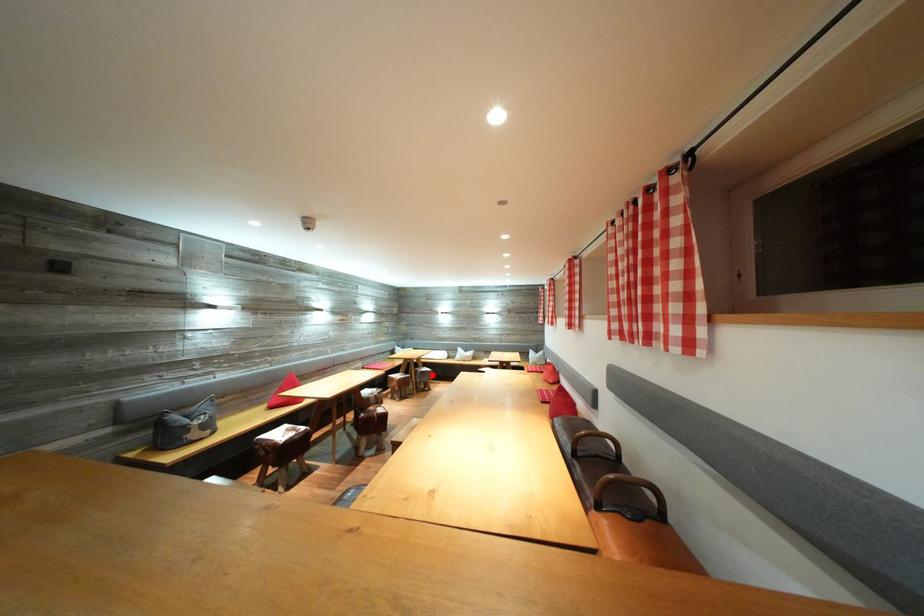
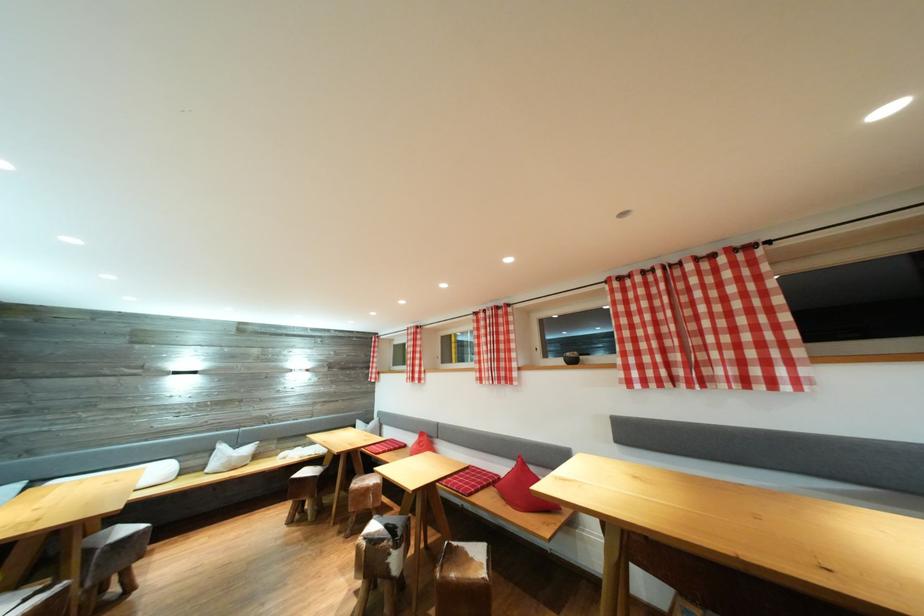
In the second image, find the point that corresponds to the highlighted location in the first image.

(131, 536)